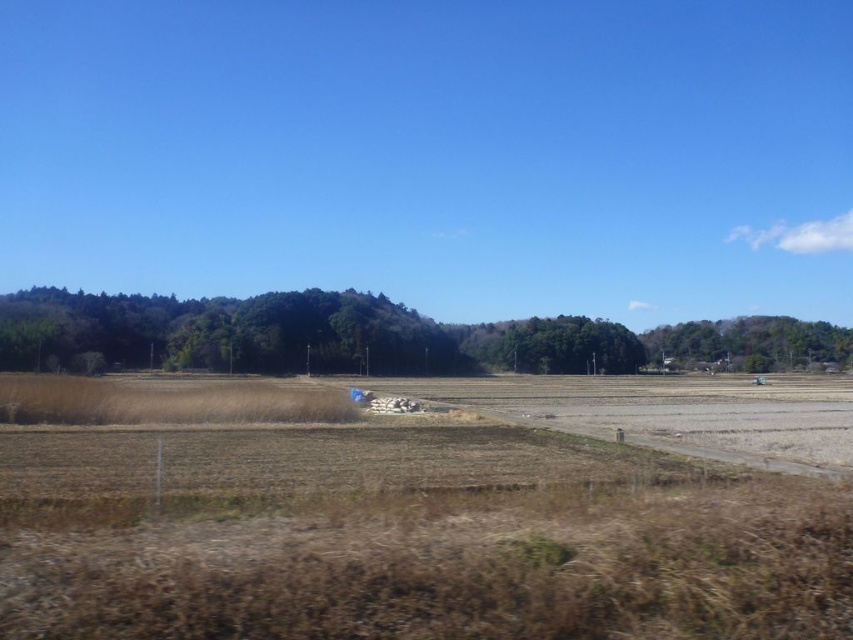
Question: Does brown dry grass at center have a larger size compared to green leafy tree at center?

Choices:
 (A) no
 (B) yes

Answer: (B)

Question: Does green leafy trees at left appear on the left side of green leafy tree at center?

Choices:
 (A) yes
 (B) no

Answer: (B)

Question: Which is nearer to the green leafy tree at right?

Choices:
 (A) green leafy trees at left
 (B) brown dry grass at center
 (C) green leafy tree at center

Answer: (A)

Question: Considering the real-world distances, which object is closest to the brown dry grass at center?

Choices:
 (A) green leafy trees at left
 (B) green leafy tree at right

Answer: (A)

Question: Considering the real-world distances, which object is farthest from the green leafy tree at right?

Choices:
 (A) green leafy trees at left
 (B) green leafy tree at center
 (C) brown dry grass at center

Answer: (C)

Question: Is green leafy trees at left wider than green leafy tree at right?

Choices:
 (A) yes
 (B) no

Answer: (A)